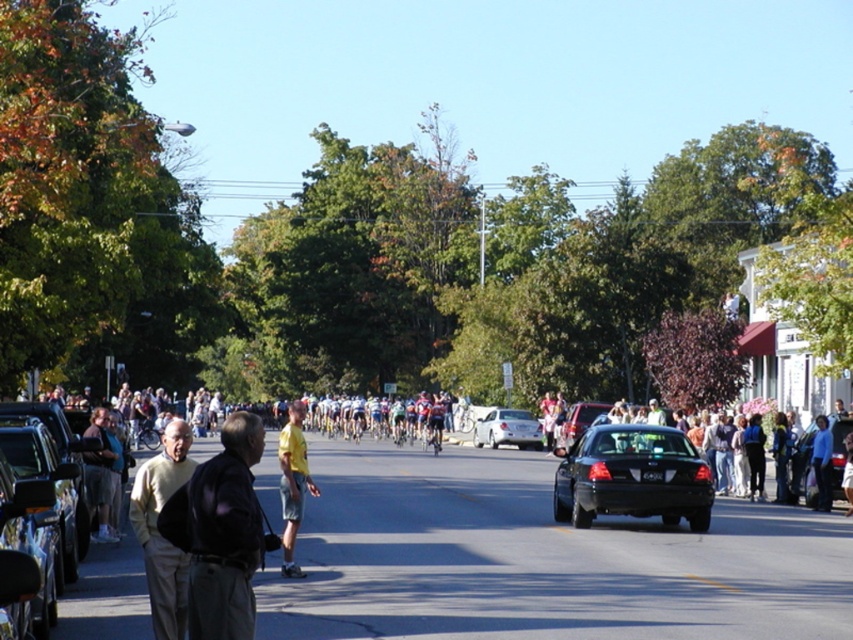
What do you see at coordinates (292, 483) in the screenshot? I see `yellow fabric shirt at center` at bounding box center [292, 483].

Can you confirm if yellow fabric shirt at center is shorter than black glossy sedan at right?

In fact, yellow fabric shirt at center may be taller than black glossy sedan at right.

This screenshot has width=853, height=640. What do you see at coordinates (292, 483) in the screenshot?
I see `yellow fabric shirt at center` at bounding box center [292, 483].

At what (x,y) coordinates should I click in order to perform the action: click on yellow fabric shirt at center. Please return your answer as a coordinate pair (x, y). Looking at the image, I should click on (292, 483).

Does point (645, 428) come closer to viewer compared to point (503, 429)?

Yes, point (645, 428) is in front of point (503, 429).

Does point (686, 451) lie in front of point (527, 428)?

Yes, it is.

Locate an element on the screen. Image resolution: width=853 pixels, height=640 pixels. black glossy sedan at center is located at coordinates (631, 476).

In the scene shown: Which is above, light beige sweater at center or white matte sedan at center?

Positioned higher is light beige sweater at center.

Does light beige sweater at center have a smaller size compared to white matte sedan at center?

Actually, light beige sweater at center might be larger than white matte sedan at center.

Is point (161, 547) less distant than point (505, 422)?

Yes, point (161, 547) is in front of point (505, 422).

The width and height of the screenshot is (853, 640). In order to click on light beige sweater at center in this screenshot , I will do `click(160, 532)`.